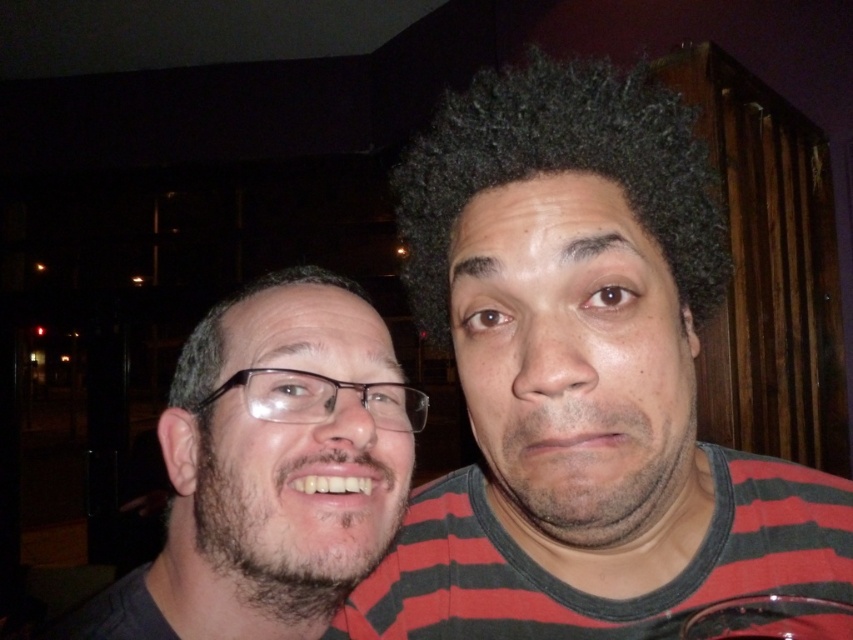
You are a photographer trying to capture a close portrait of two people. The two people are standing at point (556,182). If the minimum safe distance for your camera lens to avoid blurring is 15 inches, will you be able to take a clear photo?

The two people are 16.30 inches apart, which is greater than the minimum safe distance of 15 inches. Therefore, you can take a clear photo without blurring.

Based on the coordinates provided in the scene, where exactly is the dark curly hair at center positioned?

The dark curly hair at center is located at point (561, 170).